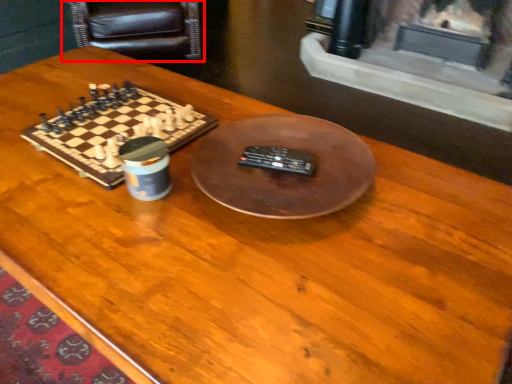
Question: From the image, what is the correct spatial relationship of armchair (annotated by the red box) in relation to board game?

Choices:
 (A) left
 (B) right

Answer: (A)